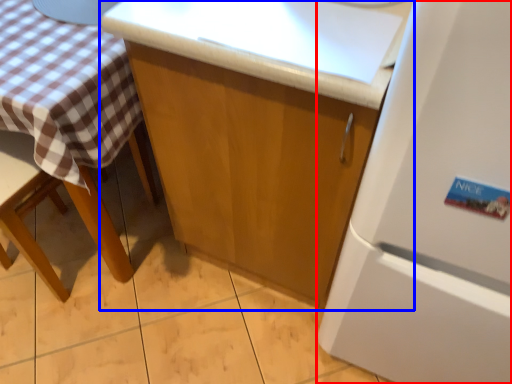
Question: Which object is closer to the camera taking this photo, refrigerator (highlighted by a red box) or cabinetry (highlighted by a blue box)?

Choices:
 (A) refrigerator
 (B) cabinetry

Answer: (A)